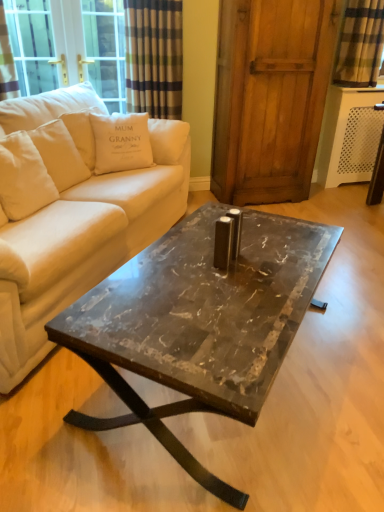
The height and width of the screenshot is (512, 384). I want to click on vacant space to the right of marble/black at center, so click(343, 352).